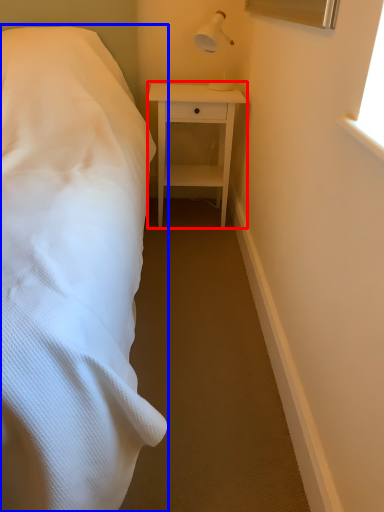
Question: Among these objects, which one is farthest to the camera, nightstand (highlighted by a red box) or bed (highlighted by a blue box)?

Choices:
 (A) nightstand
 (B) bed

Answer: (A)